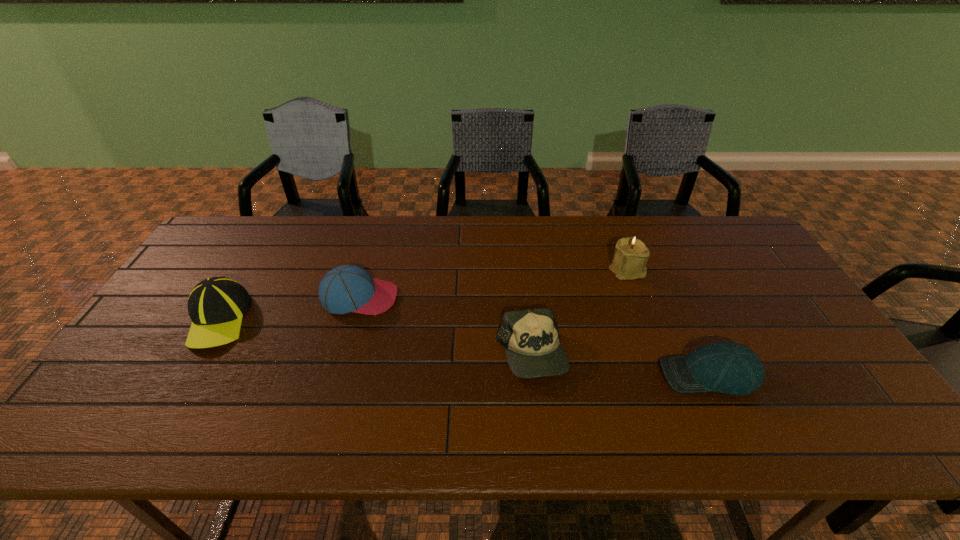
The height and width of the screenshot is (540, 960). In order to click on object that is at the left edge in this screenshot , I will do `click(216, 305)`.

Identify the location of free space at the far edge. click(x=664, y=215).

The image size is (960, 540). I want to click on vacant area at the near edge, so click(499, 433).

At what (x,y) coordinates should I click in order to perform the action: click on vacant space at the left edge of the desktop. Please return your answer as a coordinate pair (x, y). This screenshot has height=540, width=960. Looking at the image, I should click on (185, 299).

In the image, there is a desktop. Where is `blank space at the near left corner`? This screenshot has height=540, width=960. blank space at the near left corner is located at coordinates (91, 428).

Identify the location of vacant area at the far right corner. Image resolution: width=960 pixels, height=540 pixels. [741, 249].

What are the coordinates of `vacant area between the third baseball cap from left to right and the leftmost object` in the screenshot? It's located at (374, 336).

The height and width of the screenshot is (540, 960). Identify the location of vacant area that lies between the second object from left to right and the candle_holder. (493, 284).

Image resolution: width=960 pixels, height=540 pixels. What are the coordinates of `vacant space in between the second baseball cap from right to left and the third baseball cap from right to left` in the screenshot? It's located at (445, 326).

Locate an element on the screen. empty location between the third object from right to left and the rightmost baseball cap is located at coordinates (620, 364).